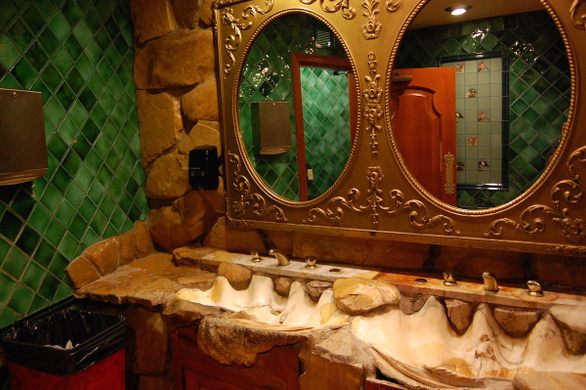
At what (x,y) coordinates should I click in order to perform the action: click on soap dispenser. Please return your answer as a coordinate pair (x, y). The image size is (586, 390). Looking at the image, I should click on (197, 144), (216, 147), (213, 194), (190, 183).